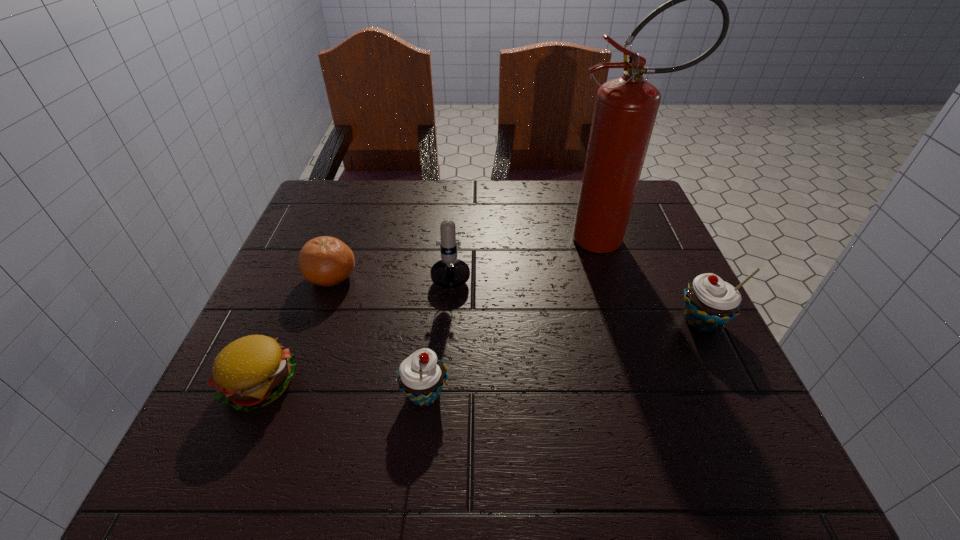
This screenshot has width=960, height=540. In order to click on empty space between the fire extinguisher and the microphone in this screenshot , I will do `click(531, 251)`.

Find the location of a particular element. This screenshot has height=540, width=960. object that is the third nearest to the hamburger is located at coordinates (450, 272).

Where is `object that is the third closest to the clementine`? object that is the third closest to the clementine is located at coordinates (421, 377).

Locate an element on the screen. The width and height of the screenshot is (960, 540). free space that satisfies the following two spatial constraints: 1. from the nozzle of the right cupcake; 2. on the left side of the fire extinguisher is located at coordinates (638, 321).

Where is `vacant area in the image that satisfies the following two spatial constraints: 1. from the nozzle of the fire extinguisher; 2. on the front side of the third shortest object`? The height and width of the screenshot is (540, 960). vacant area in the image that satisfies the following two spatial constraints: 1. from the nozzle of the fire extinguisher; 2. on the front side of the third shortest object is located at coordinates (663, 393).